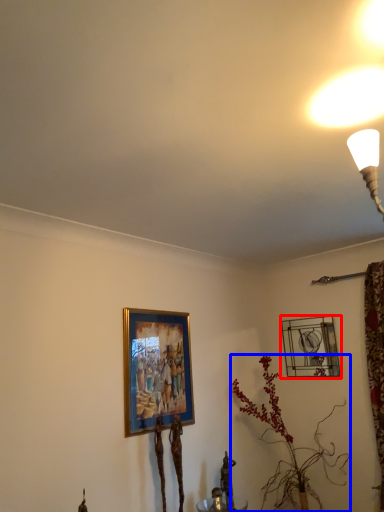
Question: Among these objects, which one is farthest to the camera, picture frame (highlighted by a red box) or houseplant (highlighted by a blue box)?

Choices:
 (A) picture frame
 (B) houseplant

Answer: (A)